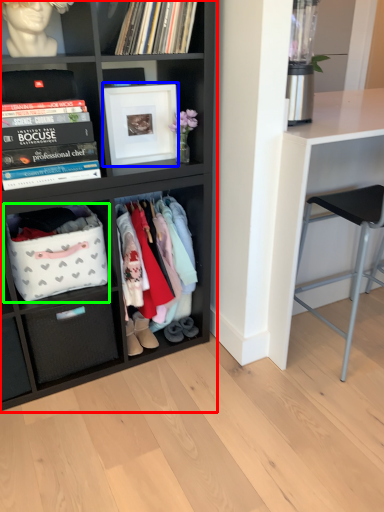
Question: Estimate the real-world distances between objects in this image. Which object is closer to shelf (highlighted by a red box), picture frame (highlighted by a blue box) or storage box (highlighted by a green box)?

Choices:
 (A) picture frame
 (B) storage box

Answer: (B)